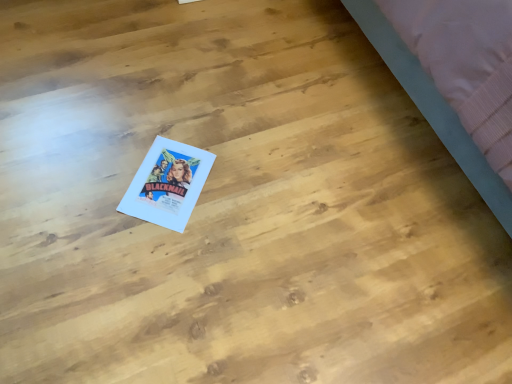
Identify the location of unoccupied area in front of white paper at center. (144, 248).